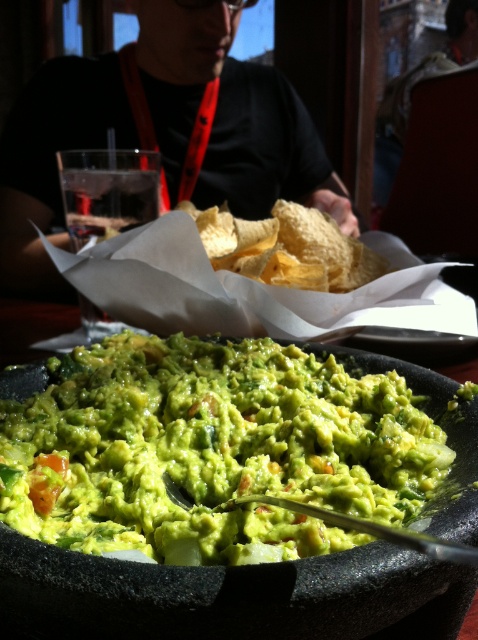
You are sitting at the table and want to reach for the green creamy guacamole at center. Which direction should you move your hand to grab it relative to the black shirt at upper center?

The green creamy guacamole at center is positioned on the right side of the black shirt at upper center, so you should move your hand to the right relative to the black shirt at upper center to grab it.

You are a food critic evaluating the presentation of the guacamole. The bowl must be wider than the person wearing the black shirt at upper center to meet the restaurant standards. Does the green creamy guacamole at center meet this requirement?

The green creamy guacamole at center has a width less than the black shirt at upper center, so it does not meet the requirement.

Based on the photo, you are a food critic evaluating the presentation of the guacamole. Considering the green creamy guacamole at center and the black shirt at upper center, which one takes up more visual space in the image?

The black shirt at upper center occupies more visual space than the green creamy guacamole at center.